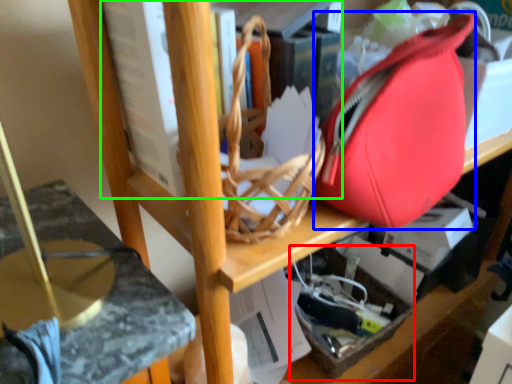
Question: Which is farther away from box (highlighted by a red box)? tote bag (highlighted by a blue box) or book (highlighted by a green box)?

Choices:
 (A) tote bag
 (B) book

Answer: (B)